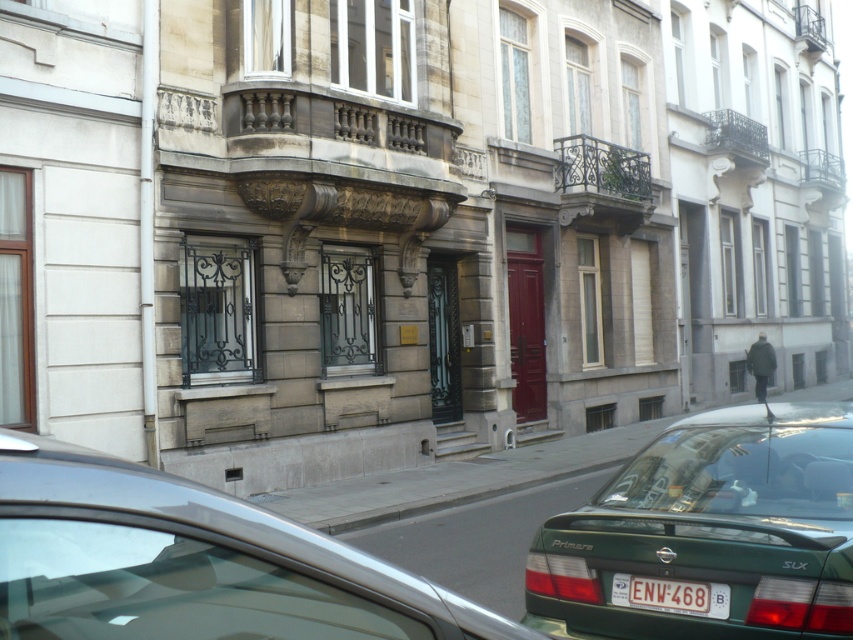
Question: Among these points, which one is nearest to the camera?

Choices:
 (A) (721, 528)
 (B) (618, 595)
 (C) (306, 573)

Answer: (C)

Question: Which point appears closest to the camera in this image?

Choices:
 (A) (535, 545)
 (B) (196, 484)

Answer: (B)

Question: Can you confirm if metallic silver car at lower left is positioned to the left of green matte car at lower right?

Choices:
 (A) no
 (B) yes

Answer: (B)

Question: Can you confirm if metallic silver car at lower left is thinner than green matte car at lower right?

Choices:
 (A) yes
 (B) no

Answer: (A)

Question: Is metallic silver car at lower left positioned before white plastic license plate at center?

Choices:
 (A) no
 (B) yes

Answer: (B)

Question: Which of the following is the farthest from the observer?

Choices:
 (A) (715, 637)
 (B) (715, 600)

Answer: (B)